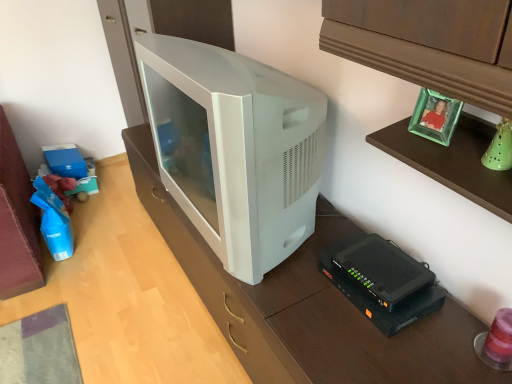
Question: Is white plastic television at center taller or shorter than black plastic router at lower right?

Choices:
 (A) tall
 (B) short

Answer: (A)

Question: Is point (270, 225) positioned closer to the camera than point (407, 294)?

Choices:
 (A) closer
 (B) farther

Answer: (B)

Question: From the image's perspective, relative to black plastic router at lower right, is white plastic television at center above or below?

Choices:
 (A) below
 (B) above

Answer: (B)

Question: Is black plastic router at lower right taller or shorter than white plastic television at center?

Choices:
 (A) short
 (B) tall

Answer: (A)

Question: Is point (391, 271) positioned closer to the camera than point (261, 180)?

Choices:
 (A) farther
 (B) closer

Answer: (A)

Question: From the image's perspective, is black plastic router at lower right positioned above or below white plastic television at center?

Choices:
 (A) above
 (B) below

Answer: (B)

Question: From a real-world perspective, is black plastic router at lower right positioned above or below white plastic television at center?

Choices:
 (A) below
 (B) above

Answer: (A)